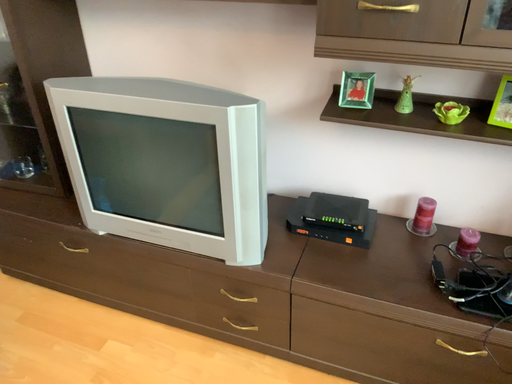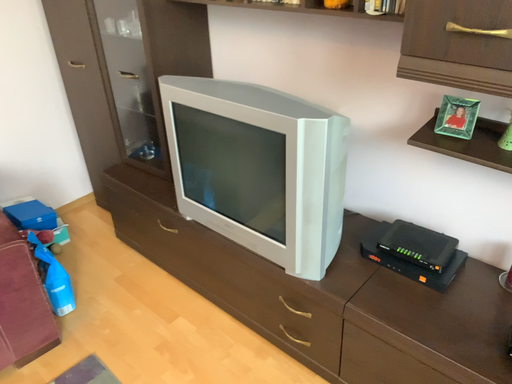
Question: Which way did the camera rotate in the video?

Choices:
 (A) rotated left
 (B) rotated right

Answer: (A)